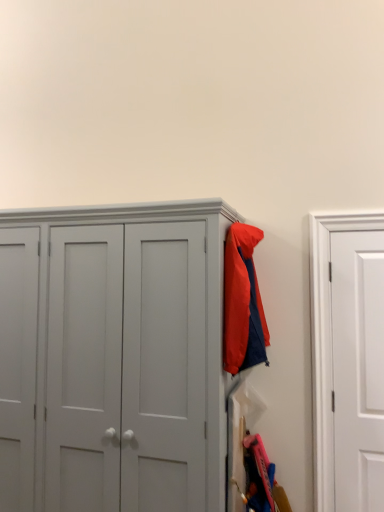
This screenshot has height=512, width=384. Describe the element at coordinates (242, 302) in the screenshot. I see `matte nylon jacket at upper right` at that location.

What do you see at coordinates (358, 369) in the screenshot? I see `white matte door at right` at bounding box center [358, 369].

The height and width of the screenshot is (512, 384). In order to click on matte nylon jacket at upper right in this screenshot , I will do `click(242, 302)`.

Which of these two, matte gray cupboard at center or matte nylon jacket at upper right, is bigger?

Bigger between the two is matte gray cupboard at center.

Is matte gray cupboard at center to the right of matte nylon jacket at upper right from the viewer's perspective?

No.

From the image's perspective, which one is positioned higher, matte gray cupboard at center or matte nylon jacket at upper right?

matte nylon jacket at upper right, from the image's perspective.

Which of these two, white matte door at right or matte nylon jacket at upper right, stands shorter?

With less height is matte nylon jacket at upper right.

Between white matte door at right and matte nylon jacket at upper right, which one has larger size?

Bigger between the two is matte nylon jacket at upper right.

From the image's perspective, is white matte door at right on matte nylon jacket at upper right?

Incorrect, from the image's perspective, white matte door at right is lower than matte nylon jacket at upper right.

From a real-world perspective, relative to matte gray cupboard at center, is matte nylon jacket at upper right vertically above or below?

Clearly, from a real-world perspective, matte nylon jacket at upper right is above matte gray cupboard at center.

From the image's perspective, does matte nylon jacket at upper right appear higher than matte gray cupboard at center?

Correct, matte nylon jacket at upper right appears higher than matte gray cupboard at center in the image.

Does matte nylon jacket at upper right touch matte gray cupboard at center?

No, matte nylon jacket at upper right is not with matte gray cupboard at center.

Visually, is matte nylon jacket at upper right positioned to the left or to the right of matte gray cupboard at center?

Based on their positions, matte nylon jacket at upper right is located to the right of matte gray cupboard at center.

Between point (359, 384) and point (47, 292), which one is positioned in front?

Point (47, 292)

Where is `cupboard located on the left of white matte door at right`? cupboard located on the left of white matte door at right is located at coordinates click(x=113, y=357).

In the scene shown: From the image's perspective, does white matte door at right appear higher than matte gray cupboard at center?

Yes.

Looking at the image, does matte gray cupboard at center seem bigger or smaller compared to white matte door at right?

Considering their sizes, matte gray cupboard at center takes up more space than white matte door at right.

Considering the positions of points (80, 290) and (345, 295), is point (80, 290) closer to camera compared to point (345, 295)?

Yes, point (80, 290) is closer to viewer.

Visually, is matte gray cupboard at center positioned to the left or to the right of white matte door at right?

From the image, it's evident that matte gray cupboard at center is to the left of white matte door at right.

Who is smaller, matte nylon jacket at upper right or white matte door at right?

white matte door at right.

From the image's perspective, is matte nylon jacket at upper right positioned above or below white matte door at right?

From the image's perspective, matte nylon jacket at upper right appears above white matte door at right.

Is matte nylon jacket at upper right at the right side of white matte door at right?

No.

At what (x,y) coordinates should I click in order to perform the action: click on door beneath the matte nylon jacket at upper right (from a real-world perspective). Please return your answer as a coordinate pair (x, y). Image resolution: width=384 pixels, height=512 pixels. Looking at the image, I should click on coord(358,369).

Locate an element on the screen. jacket behind the matte gray cupboard at center is located at coordinates (242, 302).

Where is `door on the right of matte nylon jacket at upper right`? door on the right of matte nylon jacket at upper right is located at coordinates (358, 369).

Consider the image. From the image, which object appears to be nearer to matte gray cupboard at center, white matte door at right or matte nylon jacket at upper right?

matte nylon jacket at upper right is positioned closer to the anchor matte gray cupboard at center.

Considering their positions, is matte gray cupboard at center positioned closer to matte nylon jacket at upper right than white matte door at right?

Based on the image, matte gray cupboard at center appears to be nearer to matte nylon jacket at upper right.

Which object lies nearer to the anchor point white matte door at right, matte gray cupboard at center or matte nylon jacket at upper right?

matte nylon jacket at upper right lies closer to white matte door at right than the other object.

Which object lies further to the anchor point white matte door at right, matte nylon jacket at upper right or matte gray cupboard at center?

Based on the image, matte gray cupboard at center appears to be further to white matte door at right.

Which object lies further to the anchor point matte gray cupboard at center, matte nylon jacket at upper right or white matte door at right?

Among the two, white matte door at right is located further to matte gray cupboard at center.

Estimate the real-world distances between objects in this image. Which object is further from matte nylon jacket at upper right, white matte door at right or matte gray cupboard at center?

white matte door at right.

Find the location of `jacket situated between matte gray cupboard at center and white matte door at right from left to right`. jacket situated between matte gray cupboard at center and white matte door at right from left to right is located at coordinates (242, 302).